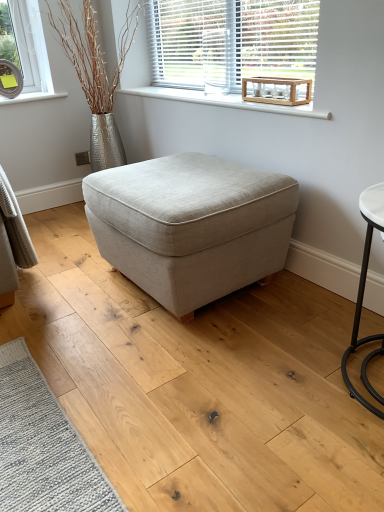
Question: Would you say white smooth window sill at upper center is part of clear glass round table at upper right's contents?

Choices:
 (A) yes
 (B) no

Answer: (B)

Question: Can you confirm if clear glass round table at upper right is wider than white smooth window sill at upper center?

Choices:
 (A) yes
 (B) no

Answer: (B)

Question: Does clear glass round table at upper right have a lesser width compared to white smooth window sill at upper center?

Choices:
 (A) no
 (B) yes

Answer: (B)

Question: Is clear glass round table at upper right next to white smooth window sill at upper center?

Choices:
 (A) yes
 (B) no

Answer: (B)

Question: From the image's perspective, is clear glass round table at upper right on top of white smooth window sill at upper center?

Choices:
 (A) no
 (B) yes

Answer: (A)

Question: Can you confirm if clear glass round table at upper right is bigger than white smooth window sill at upper center?

Choices:
 (A) no
 (B) yes

Answer: (A)

Question: Would you say clear glass round table at upper right contains wooden crate at upper center?

Choices:
 (A) no
 (B) yes

Answer: (A)

Question: Can you confirm if clear glass round table at upper right is wider than wooden crate at upper center?

Choices:
 (A) yes
 (B) no

Answer: (A)

Question: Are clear glass round table at upper right and wooden crate at upper center located far from each other?

Choices:
 (A) yes
 (B) no

Answer: (B)

Question: Can you confirm if clear glass round table at upper right is bigger than wooden crate at upper center?

Choices:
 (A) yes
 (B) no

Answer: (B)

Question: Is clear glass round table at upper right shorter than wooden crate at upper center?

Choices:
 (A) yes
 (B) no

Answer: (A)

Question: Does clear glass round table at upper right have a lesser width compared to wooden crate at upper center?

Choices:
 (A) no
 (B) yes

Answer: (A)

Question: Is white smooth window sill at upper center closer to the viewer compared to wooden crate at upper center?

Choices:
 (A) yes
 (B) no

Answer: (A)